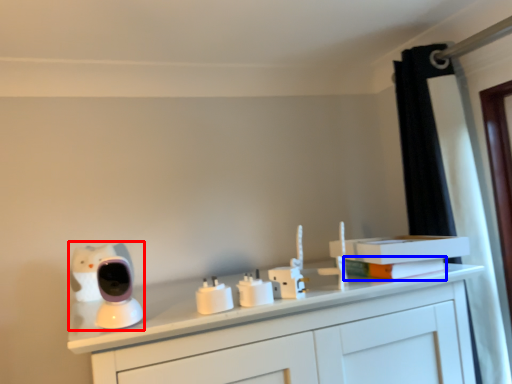
Question: Which point is closer to the camera, toy (highlighted by a red box) or book (highlighted by a blue box)?

Choices:
 (A) toy
 (B) book

Answer: (A)